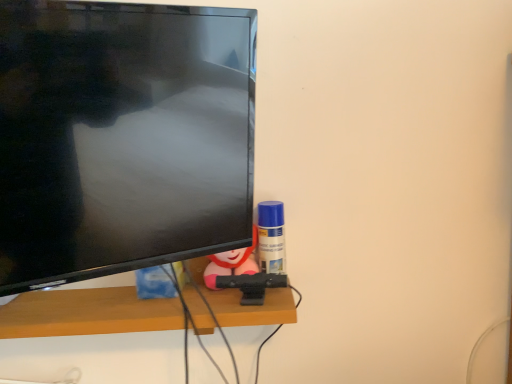
Where is `pink plush at center`? The height and width of the screenshot is (384, 512). pink plush at center is located at coordinates (231, 263).

This screenshot has width=512, height=384. What do you see at coordinates (231, 263) in the screenshot? I see `pink plush at center` at bounding box center [231, 263].

Locate an element on the screen. The height and width of the screenshot is (384, 512). pink plush at center is located at coordinates (231, 263).